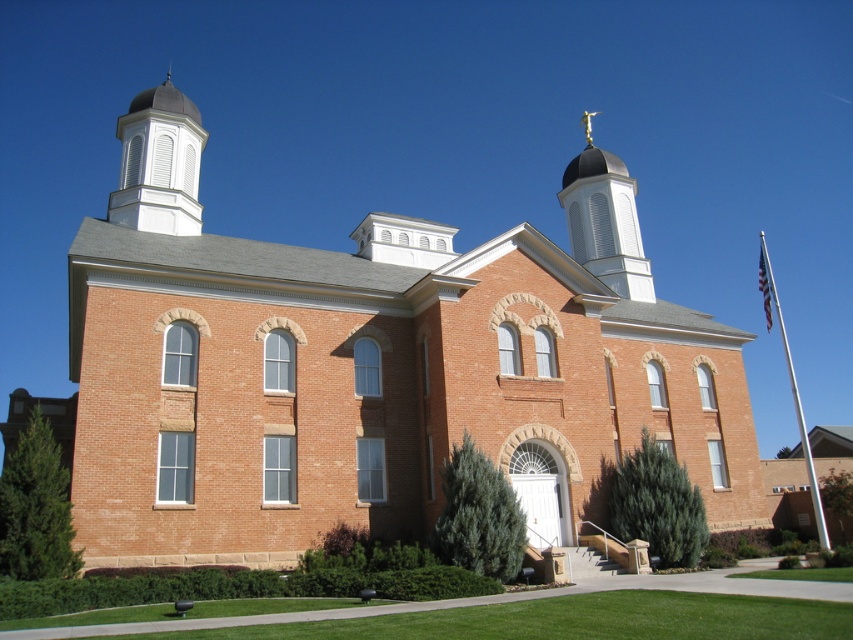
Question: Which object is farther from the camera taking this photo?

Choices:
 (A) white wood cupola at upper left
 (B) smooth white dome at upper center

Answer: (B)

Question: Is brick church at center smaller than white metallic flag pole at right?

Choices:
 (A) no
 (B) yes

Answer: (B)

Question: Which is nearer to the white wood cupola at upper left?

Choices:
 (A) white metallic flag pole at right
 (B) smooth white dome at upper center

Answer: (B)

Question: Is brick church at center to the right of white wood cupola at upper left from the viewer's perspective?

Choices:
 (A) yes
 (B) no

Answer: (A)

Question: Among these objects, which one is farthest from the camera?

Choices:
 (A) smooth white dome at upper center
 (B) white metallic flag pole at right
 (C) brick church at center

Answer: (A)

Question: Considering the relative positions of brick church at center and white metallic flag pole at right in the image provided, where is brick church at center located with respect to white metallic flag pole at right?

Choices:
 (A) below
 (B) above

Answer: (B)